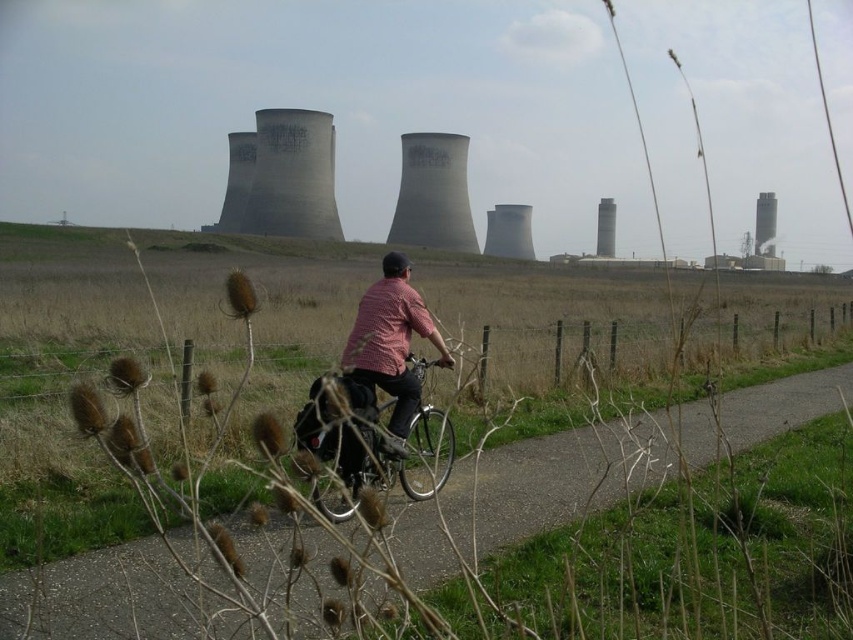
Which is more to the left, smooth asphalt path at center or smooth gray tower at upper right?

From the viewer's perspective, smooth asphalt path at center appears more on the left side.

Locate an element on the screen. smooth asphalt path at center is located at coordinates (567, 474).

Who is more distant from viewer, (68, 618) or (756, 241)?

The point (756, 241) is more distant.

Find the location of `smooth asphalt path at center`. smooth asphalt path at center is located at coordinates (567, 474).

Is shiny metallic bicycle at center smaller than smooth gray tower at upper right?

Indeed, shiny metallic bicycle at center has a smaller size compared to smooth gray tower at upper right.

Is shiny metallic bicycle at center taller than smooth gray tower at upper right?

Incorrect, shiny metallic bicycle at center's height is not larger of smooth gray tower at upper right's.

Is point (321, 404) positioned before point (759, 211)?

That is True.

Where is `shiny metallic bicycle at center`? The width and height of the screenshot is (853, 640). shiny metallic bicycle at center is located at coordinates (367, 445).

Measure the distance between smooth asphalt path at center and checkered fabric shirt at center.

They are 40.73 feet apart.

Is smooth asphalt path at center bigger than checkered fabric shirt at center?

Yes.

Identify the location of smooth asphalt path at center. (567, 474).

Identify the location of smooth asphalt path at center. coord(567,474).